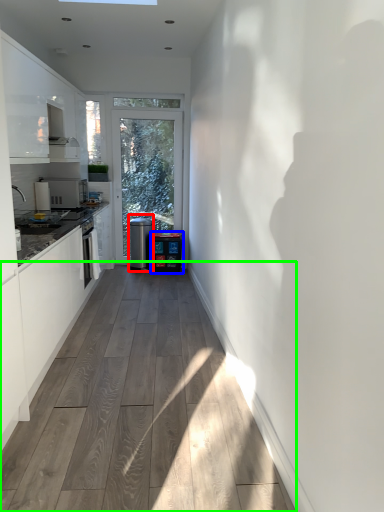
Question: Which object is positioned farthest from water cooler (highlighted by a red box)? Select from water cooler (highlighted by a blue box) and corridor (highlighted by a green box).

Choices:
 (A) water cooler
 (B) corridor

Answer: (B)